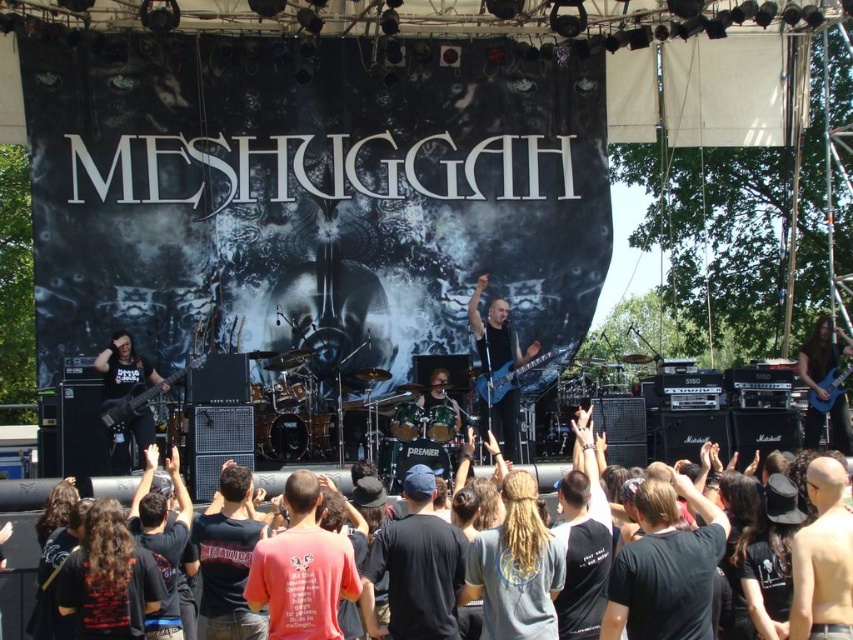
You are a stagehand who needs to place a ladder to reach the lighting fixtures above the stage. The ladder is 1.8 meters tall. Considering the height of the matte black bass guitar at left and the shiny black drum set at center, which object is more likely to block your access to the lighting fixtures if you place the ladder near them?

The matte black bass guitar at left is taller than the shiny black drum set at center, so placing the ladder near the matte black bass guitar at left would be more likely to block access to the lighting fixtures due to its greater height.

You are a photographer at the Meshuggah concert. You need to position your camera to capture the matte black bass guitar at left. Where should you aim your camera based on the coordinates provided?

The matte black bass guitar at left is located at coordinates point (125, 371), so aim your camera there.

You are a stagehand setting up a new microphone stand. You need to place it between the matte black bass guitar at left and the shiny black drum set at center. Based on their positions, where should you position the microphone stand?

The matte black bass guitar at left is to the left of the shiny black drum set at center, so you should place the microphone stand between them, closer to the center where the space between the two instruments is.